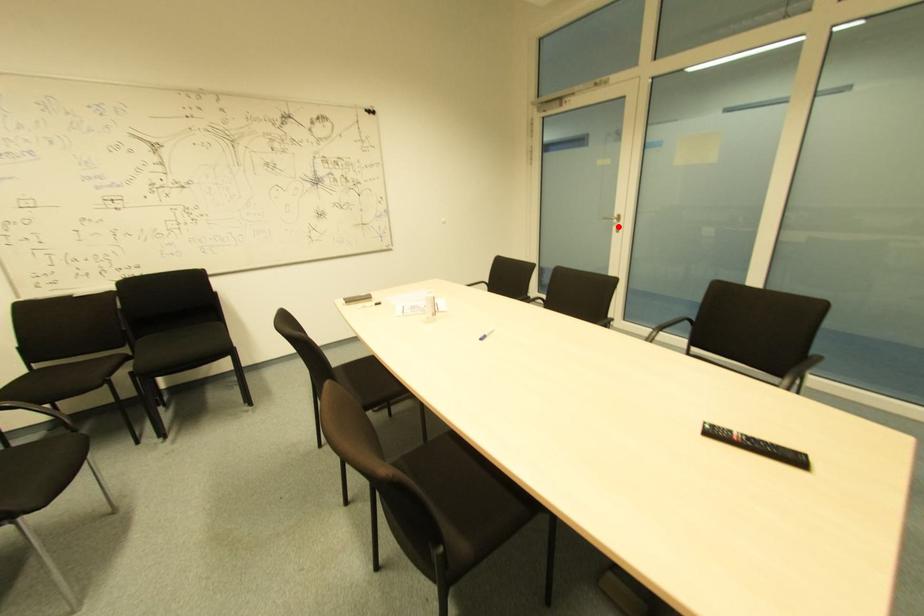
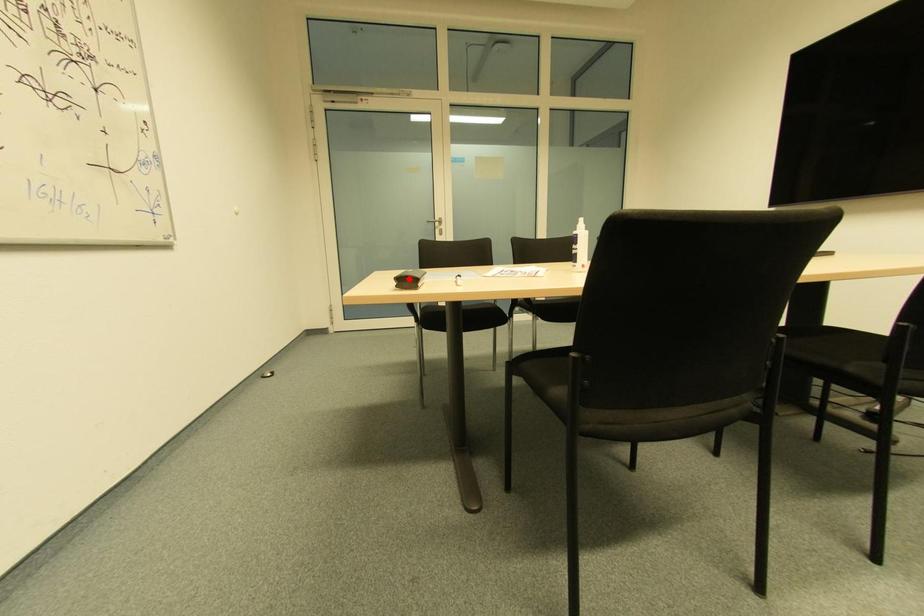
I am providing you with two images of the same scene from different viewpoints. A red point is marked on the first image and another point is marked on the second image. Do the highlighted points in image1 and image2 indicate the same real-world spot?

No